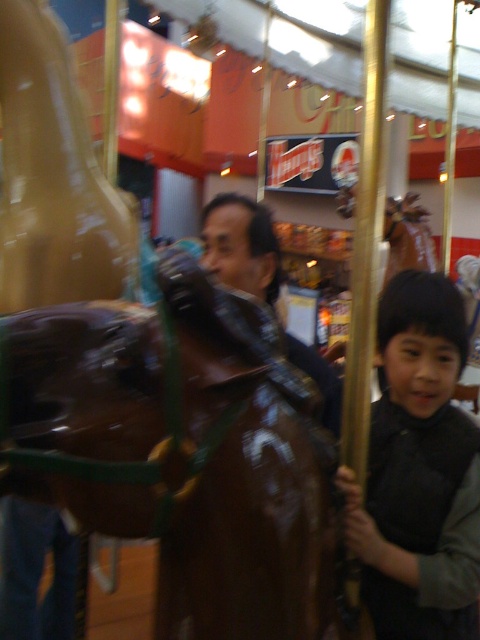
Question: Can you confirm if shiny brown horse at center is positioned below shiny brown leather jacket at center?

Choices:
 (A) yes
 (B) no

Answer: (A)

Question: Which object is farther from the camera taking this photo?

Choices:
 (A) shiny brown leather jacket at center
 (B) shiny brown horse at center

Answer: (A)

Question: Is shiny brown horse at center in front of smooth black jacket at right?

Choices:
 (A) yes
 (B) no

Answer: (A)

Question: Is shiny brown horse at center bigger than smooth black jacket at right?

Choices:
 (A) yes
 (B) no

Answer: (A)

Question: Which object appears closest to the camera in this image?

Choices:
 (A) shiny brown leather jacket at center
 (B) shiny brown horse at center
 (C) smooth black jacket at right

Answer: (B)

Question: Which point is closer to the camera?

Choices:
 (A) smooth black jacket at right
 (B) shiny brown horse at center

Answer: (B)